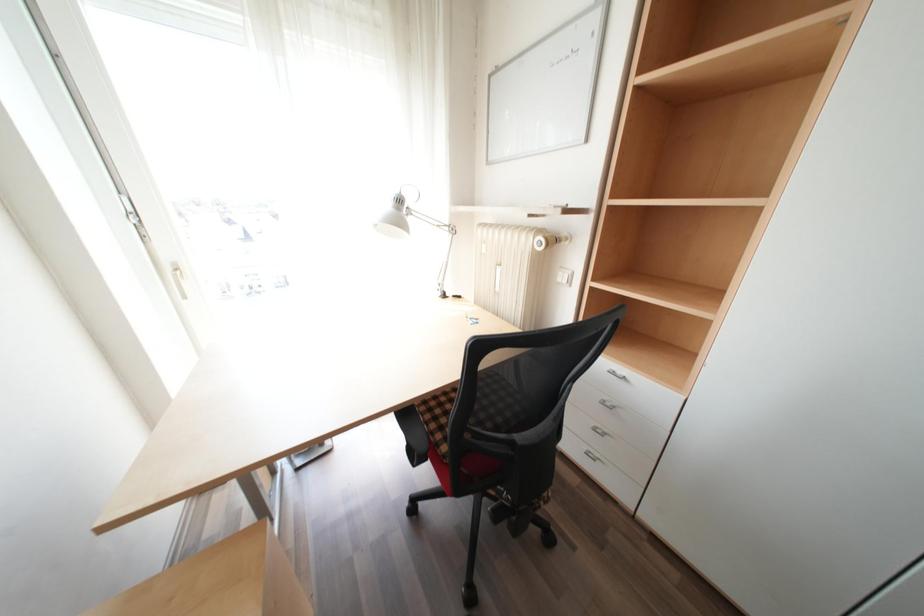
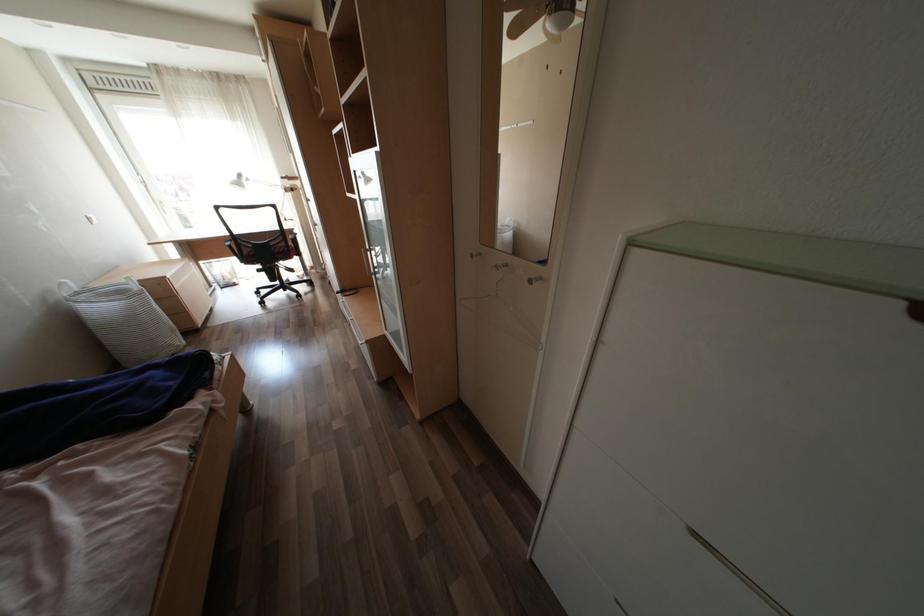
The images are taken continuously from a first-person perspective. In which direction are you moving?

The movement direction of the cameraman is right, backward.